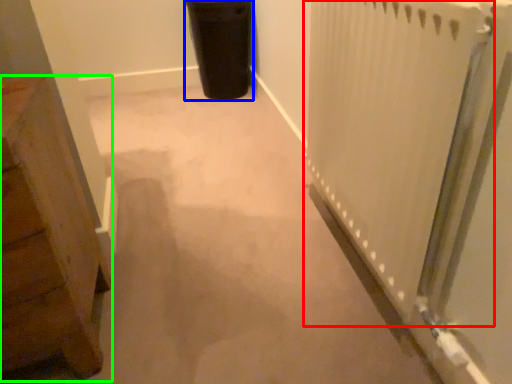
Question: Which is farther away from radiator (highlighted by a red box)? garbage (highlighted by a blue box) or furniture (highlighted by a green box)?

Choices:
 (A) garbage
 (B) furniture

Answer: (A)